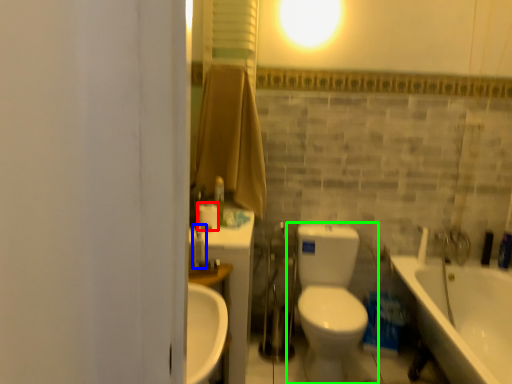
Question: Estimate the real-world distances between objects in this image. Which object is closer to toilet paper (highlighted by a red box), fixture (highlighted by a blue box) or toilet (highlighted by a green box)?

Choices:
 (A) fixture
 (B) toilet

Answer: (A)